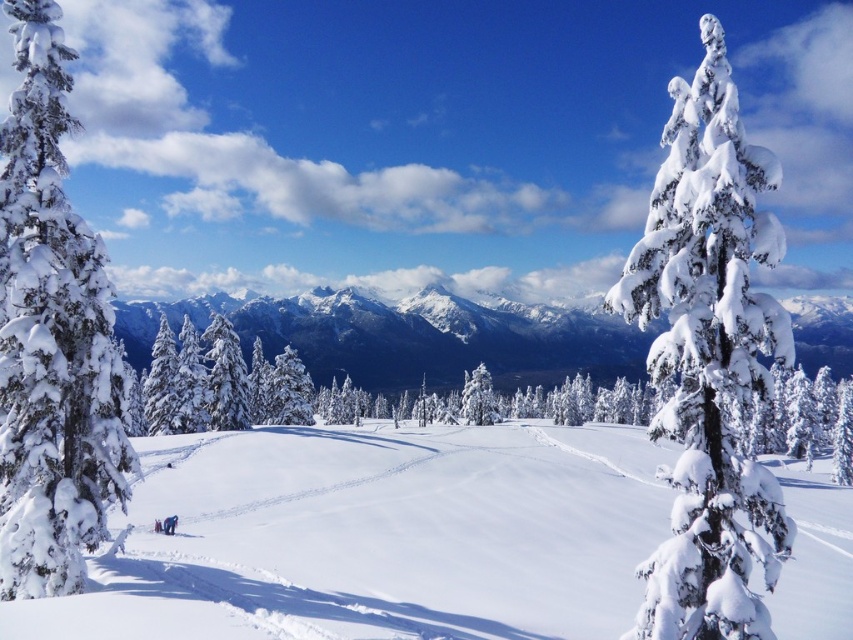
Between point (457, 628) and point (3, 1), which one is positioned in front?

Point (457, 628) is more forward.

The height and width of the screenshot is (640, 853). I want to click on white snow ski slope at center, so click(x=376, y=536).

Which is more to the right, snowy white mountain at center or white snowboard at lower left?

From the viewer's perspective, snowy white mountain at center appears more on the right side.

Describe the element at coordinates (407, 337) in the screenshot. I see `snowy white mountain at center` at that location.

Is point (554, 317) less distant than point (169, 520)?

No.

The height and width of the screenshot is (640, 853). In order to click on snowy white mountain at center in this screenshot , I will do `click(407, 337)`.

Does white snow ski slope at center come behind snow-covered evergreen at right?

That is True.

Which is behind, point (302, 490) or point (778, 504)?

The point (302, 490) is more distant.

At what (x,y) coordinates should I click in order to perform the action: click on white snow ski slope at center. Please return your answer as a coordinate pair (x, y). This screenshot has width=853, height=640. Looking at the image, I should click on (376, 536).